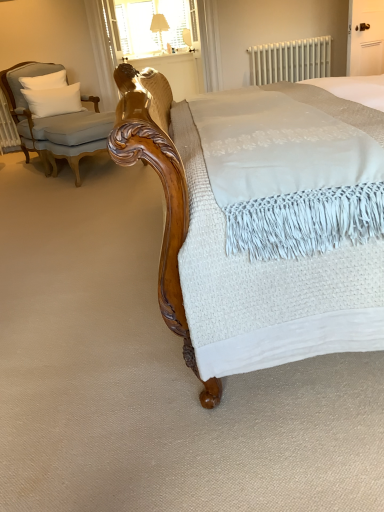
Where is `white metallic radiator at upper center`? The image size is (384, 512). white metallic radiator at upper center is located at coordinates (290, 61).

At what (x,y) coordinates should I click in order to perform the action: click on white soft cushion at upper left. Please return your answer as a coordinate pair (x, y). The width and height of the screenshot is (384, 512). Looking at the image, I should click on (51, 97).

What do you see at coordinates (177, 72) in the screenshot? The height and width of the screenshot is (512, 384). I see `wooden balustrade at upper center` at bounding box center [177, 72].

Describe the element at coordinates (150, 25) in the screenshot. I see `white fabric at upper center` at that location.

Image resolution: width=384 pixels, height=512 pixels. I want to click on white metallic radiator at upper center, so click(x=290, y=61).

Would you say matte cream fabric table lamp at upper center is outside white soft cushion at upper left?

Yes.

From the picture: Are matte cream fabric table lamp at upper center and white soft cushion at upper left beside each other?

No, matte cream fabric table lamp at upper center is not in contact with white soft cushion at upper left.

Is matte cream fabric table lamp at upper center to the left of white soft cushion at upper left from the viewer's perspective?

In fact, matte cream fabric table lamp at upper center is to the right of white soft cushion at upper left.

From a real-world perspective, which object rests below the other?

light gray fabric chair at left is physically lower.

Is white soft cushion at upper left in front of or behind light gray fabric chair at left in the image?

In the image, white soft cushion at upper left appears behind light gray fabric chair at left.

The width and height of the screenshot is (384, 512). Find the location of `chair directly beneath the white soft cushion at upper left (from a real-world perspective)`. chair directly beneath the white soft cushion at upper left (from a real-world perspective) is located at coordinates (54, 122).

Are white fabric at upper center and light gray fabric chair at left making contact?

No, white fabric at upper center is not beside light gray fabric chair at left.

Considering the sizes of objects white fabric at upper center and light gray fabric chair at left in the image provided, who is wider, white fabric at upper center or light gray fabric chair at left?

light gray fabric chair at left is wider.

Does white fabric at upper center have a smaller size compared to light gray fabric chair at left?

Yes, white fabric at upper center is smaller than light gray fabric chair at left.

Would you say light gray fabric chair at left is part of white fabric at upper center's contents?

No.

In the image, is white soft cushion at upper left positioned in front of or behind white metallic radiator at upper center?

white soft cushion at upper left is positioned closer to the viewer than white metallic radiator at upper center.

How much distance is there between white soft cushion at upper left and white metallic radiator at upper center?

white soft cushion at upper left is 3.29 meters from white metallic radiator at upper center.

Considering the relative sizes of white soft cushion at upper left and white metallic radiator at upper center in the image provided, is white soft cushion at upper left shorter than white metallic radiator at upper center?

Indeed, white soft cushion at upper left has a lesser height compared to white metallic radiator at upper center.

Is point (45, 86) less distant than point (305, 58)?

Yes.

Is light gray fabric chair at left oriented away from white soft cushion at upper left?

Yes, light gray fabric chair at left is positioned with its back facing white soft cushion at upper left.

Is point (64, 71) more distant than point (53, 109)?

Yes, point (64, 71) is farther from viewer.

From a real-world perspective, between light gray fabric chair at left and white soft cushion at upper left, who is vertically lower?

light gray fabric chair at left is physically lower.

In the scene shown: Can you confirm if light gray fabric chair at left is wider than white soft cushion at upper left?

Yes, light gray fabric chair at left is wider than white soft cushion at upper left.

From the image's perspective, between wooden balustrade at upper center and white fabric at upper center, who is located below?

From the image's view, wooden balustrade at upper center is below.

Can you confirm if wooden balustrade at upper center is shorter than white fabric at upper center?

Yes, wooden balustrade at upper center is shorter than white fabric at upper center.

Is white fabric at upper center at the back of wooden balustrade at upper center?

No, wooden balustrade at upper center is not facing away from white fabric at upper center.

Does point (136, 59) appear closer or farther from the camera than point (165, 16)?

Point (136, 59) appears to be closer to the viewer than point (165, 16).

Is white fabric at upper center touching matte cream fabric table lamp at upper center?

No, white fabric at upper center is not making contact with matte cream fabric table lamp at upper center.

Considering their positions, is white fabric at upper center located in front of or behind matte cream fabric table lamp at upper center?

In the image, white fabric at upper center appears behind matte cream fabric table lamp at upper center.

The width and height of the screenshot is (384, 512). What are the coordinates of `table lamp behind the white soft cushion at upper left` in the screenshot? It's located at (159, 26).

You are a GUI agent. You are given a task and a screenshot of the screen. Output one action in this format:
    pyautogui.click(x=<x>, y=<y>)
    Task: Click on the pillow above the light gray fabric chair at left (from the image's perspective)
    
    Given the screenshot: What is the action you would take?
    pyautogui.click(x=51, y=97)

From the image, which object appears to be farther from wooden balustrade at upper center, white soft cushion at upper left or light gray fabric chair at left?

light gray fabric chair at left.

Looking at the image, which one is located closer to wooden balustrade at upper center, white metallic radiator at upper center or matte cream fabric table lamp at upper center?

matte cream fabric table lamp at upper center lies closer to wooden balustrade at upper center than the other object.

Looking at the image, which one is located further to light gray fabric chair at left, wooden balustrade at upper center or white fabric at upper center?

The object further to light gray fabric chair at left is white fabric at upper center.

Looking at the image, which one is located further to matte cream fabric table lamp at upper center, light gray fabric chair at left or wooden balustrade at upper center?

light gray fabric chair at left lies further to matte cream fabric table lamp at upper center than the other object.

From the image, which object appears to be nearer to light gray fabric chair at left, white fabric at upper center or wooden balustrade at upper center?

wooden balustrade at upper center lies closer to light gray fabric chair at left than the other object.

Based on their spatial positions, is wooden balustrade at upper center or white soft cushion at upper left further from white metallic radiator at upper center?

The object further to white metallic radiator at upper center is white soft cushion at upper left.

Which object lies nearer to the anchor point light gray fabric chair at left, wooden balustrade at upper center or matte cream fabric table lamp at upper center?

A: wooden balustrade at upper center lies closer to light gray fabric chair at left than the other object.

Considering their positions, is matte cream fabric table lamp at upper center positioned closer to wooden balustrade at upper center than white fabric at upper center?

white fabric at upper center is closer to wooden balustrade at upper center.

Locate an element on the screen. The height and width of the screenshot is (512, 384). radiator between light gray fabric chair at left and matte cream fabric table lamp at upper center from front to back is located at coordinates (290, 61).

Find the location of a particular element. This screenshot has width=384, height=512. balustrade positioned between white metallic radiator at upper center and white fabric at upper center from near to far is located at coordinates (177, 72).

You are a GUI agent. You are given a task and a screenshot of the screen. Output one action in this format:
    pyautogui.click(x=<x>, y=<y>)
    Task: Click on the radiator between white soft cushion at upper left and matte cream fabric table lamp at upper center along the z-axis
    The image size is (384, 512).
    Given the screenshot: What is the action you would take?
    pyautogui.click(x=290, y=61)

Locate an element on the screen. This screenshot has height=512, width=384. pillow located between light gray fabric chair at left and matte cream fabric table lamp at upper center in the depth direction is located at coordinates (51, 97).